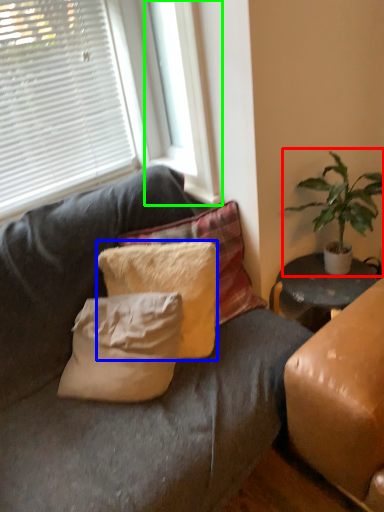
Question: Based on their relative distances, which object is nearer to houseplant (highlighted by a red box)? Choose from pillow (highlighted by a blue box) and window frame (highlighted by a green box).

Choices:
 (A) pillow
 (B) window frame

Answer: (B)